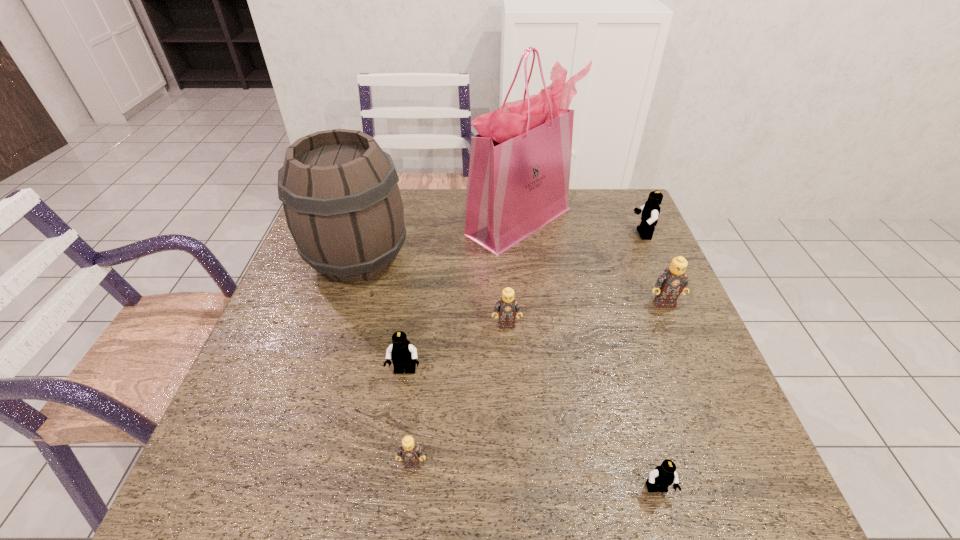
You are a GUI agent. You are given a task and a screenshot of the screen. Output one action in this format:
    pyautogui.click(x=<x>, y=<y>)
    Task: Click on the third nearest object
    The height and width of the screenshot is (540, 960).
    Given the screenshot: What is the action you would take?
    tap(402, 353)

Find the location of a particular element. Image resolution: width=960 pixels, height=540 pixels. the smallest tan Lego is located at coordinates (x=411, y=453).

You are a GUI agent. You are given a task and a screenshot of the screen. Output one action in this format:
    pyautogui.click(x=<x>, y=<y>)
    Task: Click on the leftmost tan Lego
    This screenshot has height=540, width=960.
    Given the screenshot: What is the action you would take?
    pyautogui.click(x=411, y=453)

Where is `the smallest black Lego`? This screenshot has width=960, height=540. the smallest black Lego is located at coordinates (663, 476).

Locate an element on the screen. the second black Lego from right to left is located at coordinates (663, 476).

Image resolution: width=960 pixels, height=540 pixels. What are the coordinates of `vacant space situated 0.350m on the front of the tallest object` in the screenshot? It's located at (534, 353).

Locate an element on the screen. vacant point located on the front of the wine bucket is located at coordinates (337, 324).

I want to click on vacant position located 0.080m on the front-facing side of the rightmost black Lego, so click(x=607, y=234).

Locate an element on the screen. blank space located 0.330m on the front-facing side of the rightmost black Lego is located at coordinates (525, 234).

Find the location of a particular element. vacant space positioned 0.330m on the front-facing side of the rightmost black Lego is located at coordinates (525, 234).